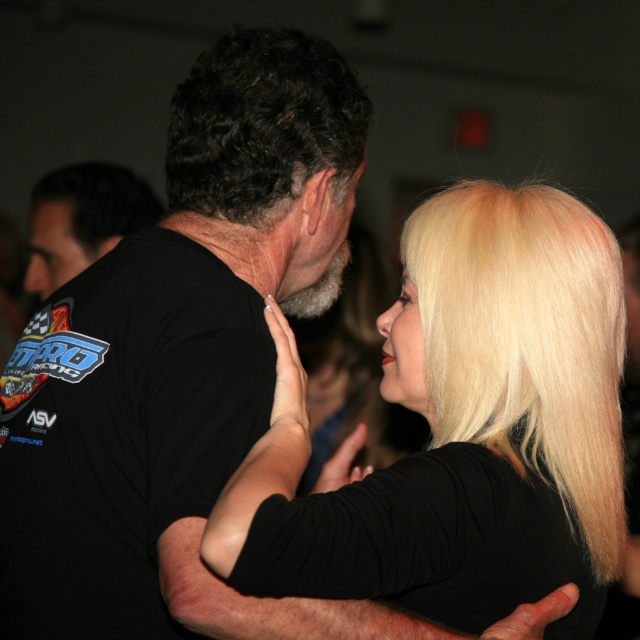
Image resolution: width=640 pixels, height=640 pixels. What do you see at coordinates (262, 124) in the screenshot?
I see `dark curly hair at upper center` at bounding box center [262, 124].

Can you confirm if dark curly hair at upper center is bigger than black fabric shirt at left?

No.

Is point (284, 44) closer to camera compared to point (72, 248)?

Yes, point (284, 44) is in front of point (72, 248).

This screenshot has width=640, height=640. Find the location of `dark curly hair at upper center`. dark curly hair at upper center is located at coordinates point(262,124).

Can you confirm if blonde hair at upper right is positioned above dark curly hair at upper center?

Actually, blonde hair at upper right is below dark curly hair at upper center.

Consider the image. Does blonde hair at upper right have a smaller size compared to dark curly hair at upper center?

No.

What do you see at coordinates (461, 428) in the screenshot? This screenshot has width=640, height=640. I see `blonde hair at upper right` at bounding box center [461, 428].

I want to click on blonde hair at upper right, so click(x=461, y=428).

Who is positioned more to the right, blonde silky hair at right or dark curly hair at upper center?

Positioned to the right is blonde silky hair at right.

Does blonde silky hair at right have a lesser width compared to dark curly hair at upper center?

No.

Is point (536, 225) positioned after point (221, 88)?

No, it is not.

Identify the location of blonde silky hair at right. (528, 342).